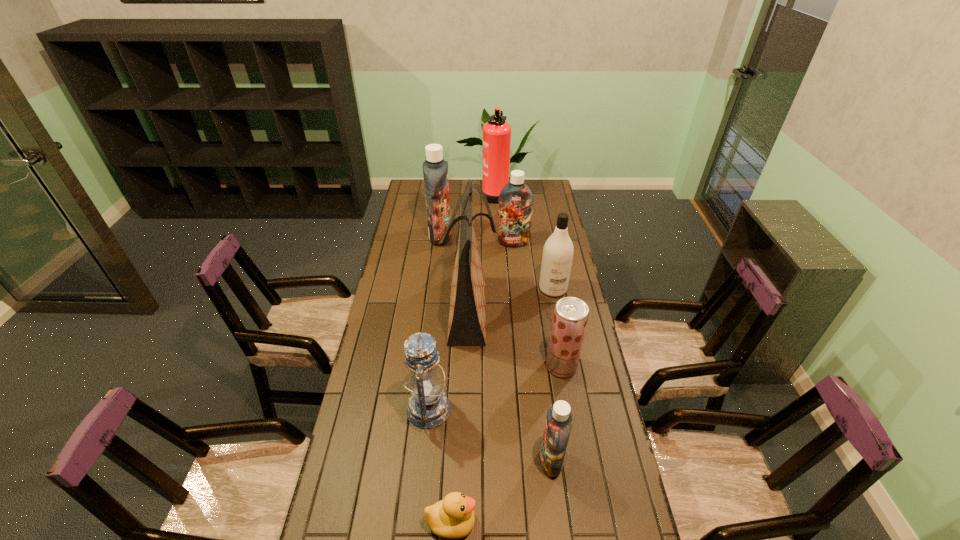
Find the location of a particular element. The height and width of the screenshot is (540, 960). vacant space at the right edge of the desktop is located at coordinates (544, 305).

The height and width of the screenshot is (540, 960). I want to click on free spot between the second biggest blue shampoo and the shopping bag, so pos(492,276).

Locate an element on the screen. free point between the fire extinguisher and the smallest blue shampoo is located at coordinates (523, 327).

Identify the location of empty space that is in between the second nearest object and the second smallest blue shampoo. This screenshot has height=540, width=960. (532, 352).

The image size is (960, 540). I want to click on free spot between the shopping bag and the farthest object, so click(483, 251).

Identify which object is the eighth closest to the nearest object. Please provide its 2D coordinates. Your answer should be formatted as a tuple, i.e. [(x, y)], where the tuple contains the x and y coordinates of a point satisfying the conditions above.

[(496, 132)]

Select which object is the second closest to the seventh farthest object. Please provide its 2D coordinates. Your answer should be formatted as a tuple, i.e. [(x, y)], where the tuple contains the x and y coordinates of a point satisfying the conditions above.

[(453, 517)]

Locate an element on the screen. shampoo that is the fourth closest one to the farthest object is located at coordinates (558, 424).

Find the location of a particular element. Image resolution: width=960 pixels, height=540 pixels. shampoo that stands as the third closest to the second biggest blue shampoo is located at coordinates (558, 424).

Locate an element on the screen. The height and width of the screenshot is (540, 960). blue shampoo identified as the closest to the shortest shampoo is located at coordinates (515, 199).